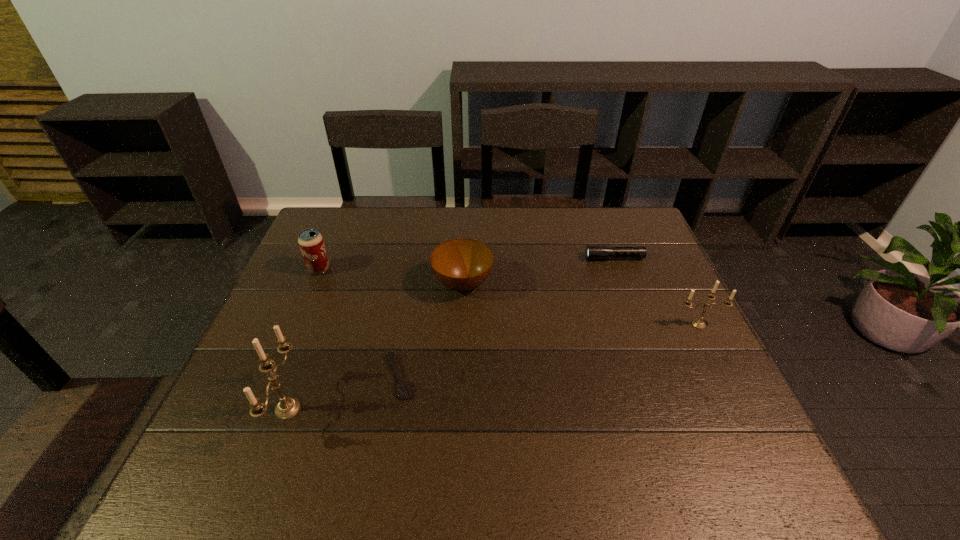
This screenshot has height=540, width=960. In order to click on the left candle in this screenshot , I will do `click(287, 408)`.

Where is `the nearer candle`? The image size is (960, 540). the nearer candle is located at coordinates [287, 408].

Locate an element on the screen. The image size is (960, 540). the shorter candle is located at coordinates (697, 323).

Find the location of `the fourth farthest object`. the fourth farthest object is located at coordinates (697, 323).

You are a GUI agent. You are given a task and a screenshot of the screen. Output one action in this format:
    pyautogui.click(x=<x>, y=<y>)
    Task: Click on the third tallest object
    This screenshot has width=960, height=540.
    Given the screenshot: What is the action you would take?
    coord(310,241)

Identify the location of the leftmost object. (310, 241).

The width and height of the screenshot is (960, 540). What are the coordinates of `the third object from right to left` in the screenshot? It's located at (462, 264).

You are a GUI agent. You are given a task and a screenshot of the screen. Output one action in this format:
    pyautogui.click(x=<x>, y=<y>)
    Task: Click on the bowl
    The height and width of the screenshot is (540, 960).
    Given the screenshot: What is the action you would take?
    pyautogui.click(x=462, y=264)

The image size is (960, 540). I want to click on the fourth object from right to left, so click(x=403, y=388).

In order to click on the shortest object in this screenshot , I will do `click(403, 388)`.